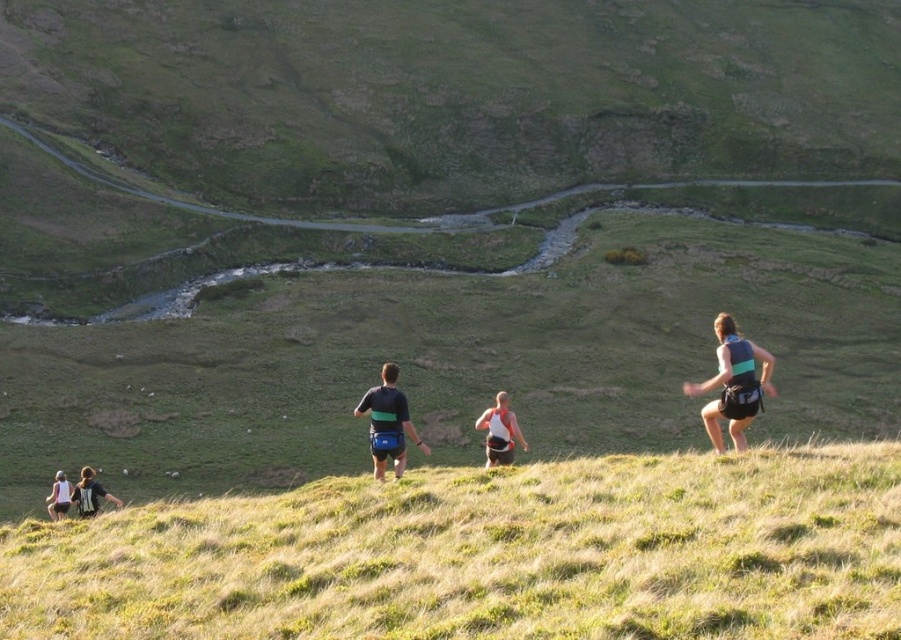
You are a runner looking at the image and want to know which object is lower in height between the green grassy hillside at center and the green fabric vest at right. Can you tell me?

The green grassy hillside at center is lower in height compared to the green fabric vest at right.

You are a photographer positioned at the bottom of the hill. You want to capture a photo of the runners so that both the green fabric vest at right and the dark blue fabric shorts at center are clearly visible. Which object should you focus on to ensure both are in sharp focus?

The green fabric vest at right is larger in size than the dark blue fabric shorts at center, so focusing on the larger object will help ensure both are in focus.

You are a photographer positioned at the bottom of the hill. You want to capture a photo of the runners where both the green fabric vest at right and the dark blue fabric shorts at center are clearly visible. Considering their sizes, which object should you focus on to ensure both are in frame?

The green fabric vest at right is wider than the dark blue fabric shorts at center, so focusing on the green fabric vest at right will ensure both objects are within the camera frame since it takes up more space.